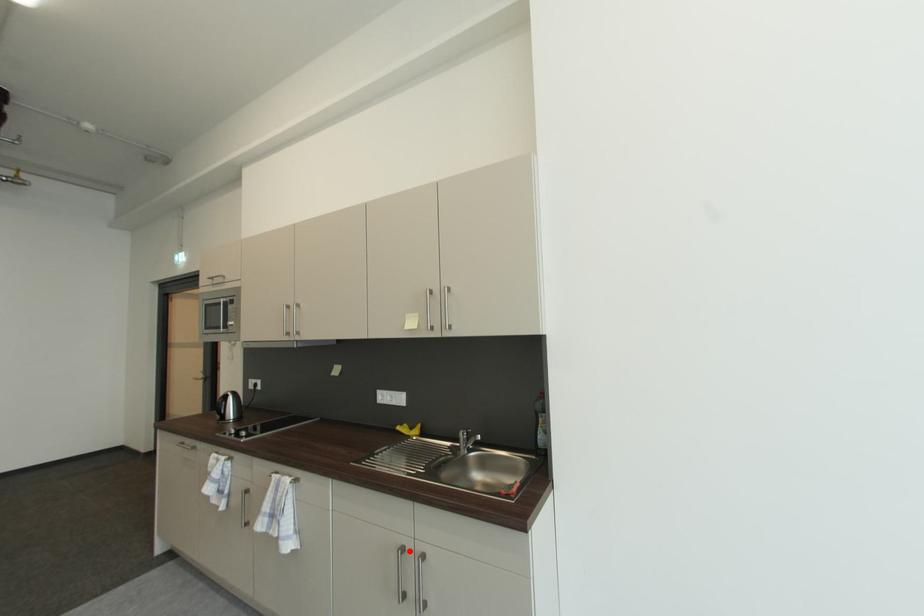
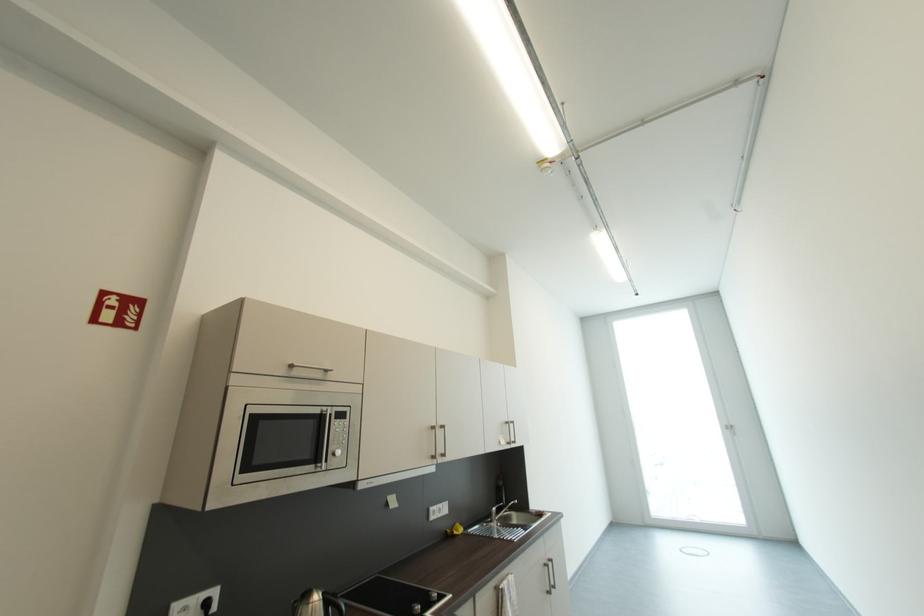
The point at the highlighted location is marked in the first image. Where is the corresponding point in the second image?

(552, 567)